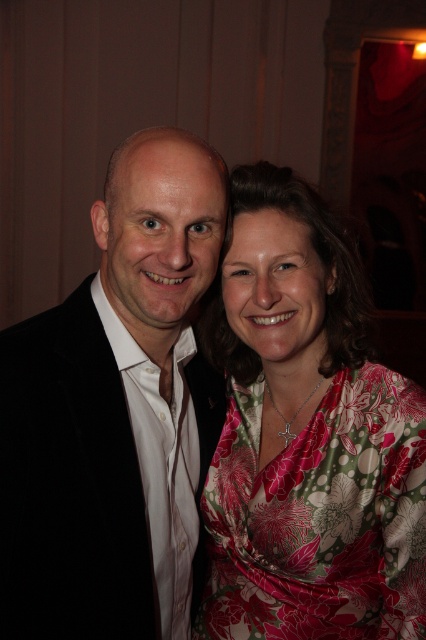
How far apart are black velvet suit at left and floral silk dress at center?

10.40 inches

Who is more distant from viewer, [46,632] or [250,564]?

The point [250,564] is behind.

This screenshot has width=426, height=640. What do you see at coordinates (115, 412) in the screenshot?
I see `black velvet suit at left` at bounding box center [115, 412].

Identify the location of black velvet suit at left. This screenshot has width=426, height=640. (115, 412).